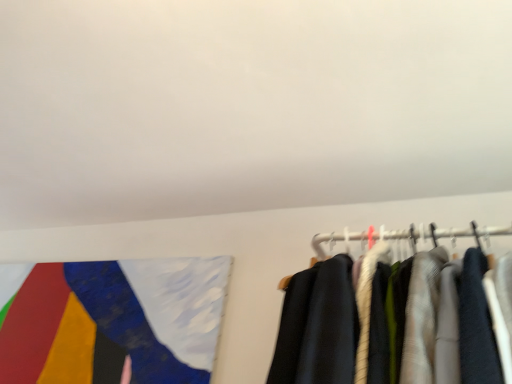
Question: Is white matte wall at upper center oriented away from painted fabric flag at upper left?

Choices:
 (A) yes
 (B) no

Answer: (B)

Question: Is there a large distance between white matte wall at upper center and painted fabric flag at upper left?

Choices:
 (A) no
 (B) yes

Answer: (A)

Question: Can you confirm if white matte wall at upper center is smaller than painted fabric flag at upper left?

Choices:
 (A) no
 (B) yes

Answer: (A)

Question: Can you confirm if white matte wall at upper center is shorter than painted fabric flag at upper left?

Choices:
 (A) yes
 (B) no

Answer: (A)

Question: Is white matte wall at upper center wider than painted fabric flag at upper left?

Choices:
 (A) yes
 (B) no

Answer: (A)

Question: Can you confirm if white matte wall at upper center is taller than painted fabric flag at upper left?

Choices:
 (A) no
 (B) yes

Answer: (A)

Question: Is painted fabric flag at upper left shorter than white matte wall at upper center?

Choices:
 (A) no
 (B) yes

Answer: (A)

Question: Considering the relative positions of painted fabric flag at upper left and white matte wall at upper center in the image provided, is painted fabric flag at upper left to the left of white matte wall at upper center from the viewer's perspective?

Choices:
 (A) no
 (B) yes

Answer: (B)

Question: From a real-world perspective, is painted fabric flag at upper left positioned over white matte wall at upper center based on gravity?

Choices:
 (A) yes
 (B) no

Answer: (B)

Question: Is painted fabric flag at upper left not close to white matte wall at upper center?

Choices:
 (A) no
 (B) yes

Answer: (A)

Question: Does painted fabric flag at upper left contain white matte wall at upper center?

Choices:
 (A) no
 (B) yes

Answer: (A)

Question: Is painted fabric flag at upper left located outside white matte wall at upper center?

Choices:
 (A) no
 (B) yes

Answer: (B)

Question: From the image's perspective, is white matte wall at upper center above or below painted fabric flag at upper left?

Choices:
 (A) above
 (B) below

Answer: (A)